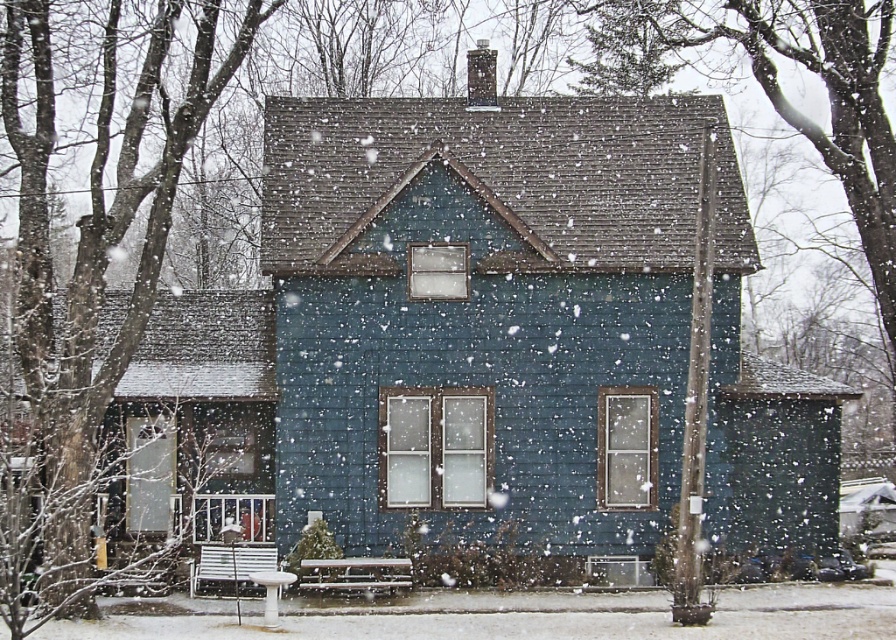
You are standing at the entrance of the house and want to sit down. Which bench, the metallic silver bench at lower center or the white plastic park bench at lower left, is closer to you?

The metallic silver bench at lower center is closer to you since it is positioned below the white plastic park bench at lower left, indicating it is nearer in the scene.

You are standing in front of the house and want to sit down. There is a metallic silver bench at lower center and a white plastic park bench at lower left. Which bench is closer to the right side of the house?

The metallic silver bench at lower center is to the right of the white plastic park bench at lower left, so it is closer to the right side of the house.